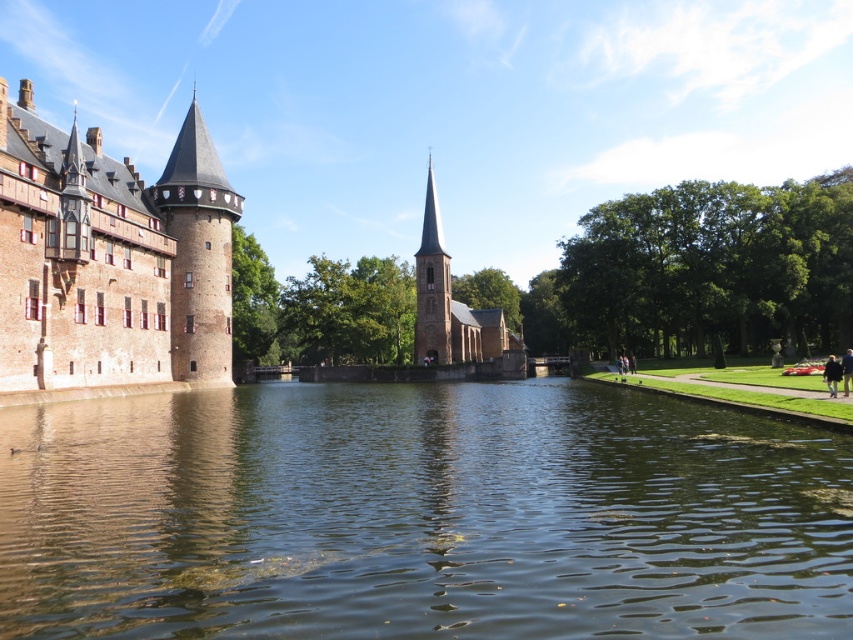
You are standing at the point marked as point (x=419, y=515). What is the color and type of the surface you are currently standing on?

The surface at point (x=419, y=515) is greenish brown water at center.